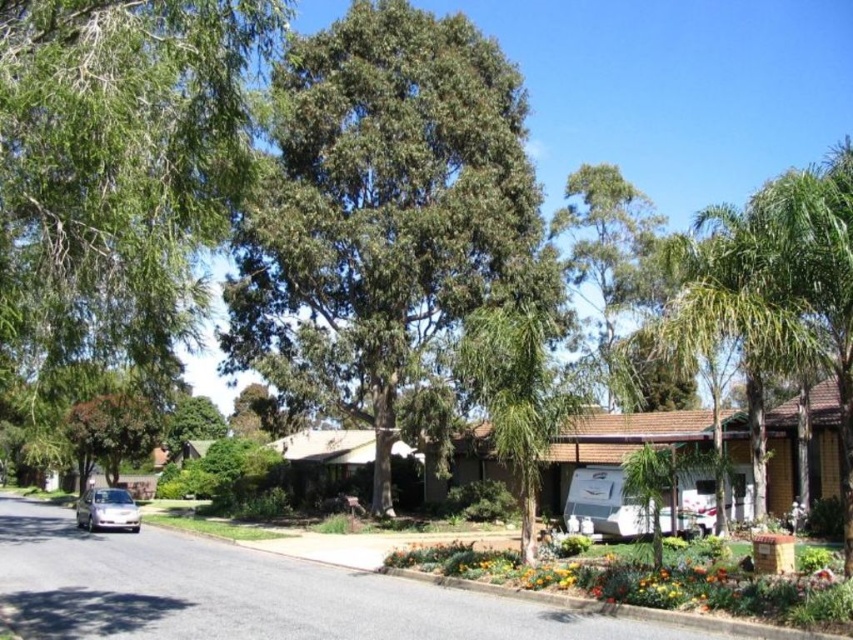
Does green leafy tree at center appear on the left side of green leafy palm tree at right?

Yes, green leafy tree at center is to the left of green leafy palm tree at right.

Does green leafy tree at center have a lesser height compared to green leafy palm tree at right?

Yes.

Who is more distant from viewer, [369,97] or [846,241]?

Positioned behind is point [369,97].

Locate an element on the screen. This screenshot has height=640, width=853. green leafy tree at center is located at coordinates (381, 211).

From the picture: Which is above, green leafy tree at upper center or silver metallic car at lower left?

green leafy tree at upper center is above.

Is green leafy tree at upper center shorter than silver metallic car at lower left?

Incorrect, green leafy tree at upper center's height does not fall short of silver metallic car at lower left's.

Who is more forward, [583,224] or [102,492]?

Point [102,492]

The width and height of the screenshot is (853, 640). In order to click on green leafy tree at upper center in this screenshot , I will do `click(608, 252)`.

The height and width of the screenshot is (640, 853). Describe the element at coordinates (781, 288) in the screenshot. I see `green leafy palm tree at right` at that location.

Can you confirm if green leafy palm tree at right is positioned below silver metallic car at lower left?

Incorrect, green leafy palm tree at right is not positioned below silver metallic car at lower left.

Is point (735, 250) farther from viewer compared to point (97, 493)?

No.

Where is `green leafy palm tree at right`? This screenshot has width=853, height=640. green leafy palm tree at right is located at coordinates (781, 288).